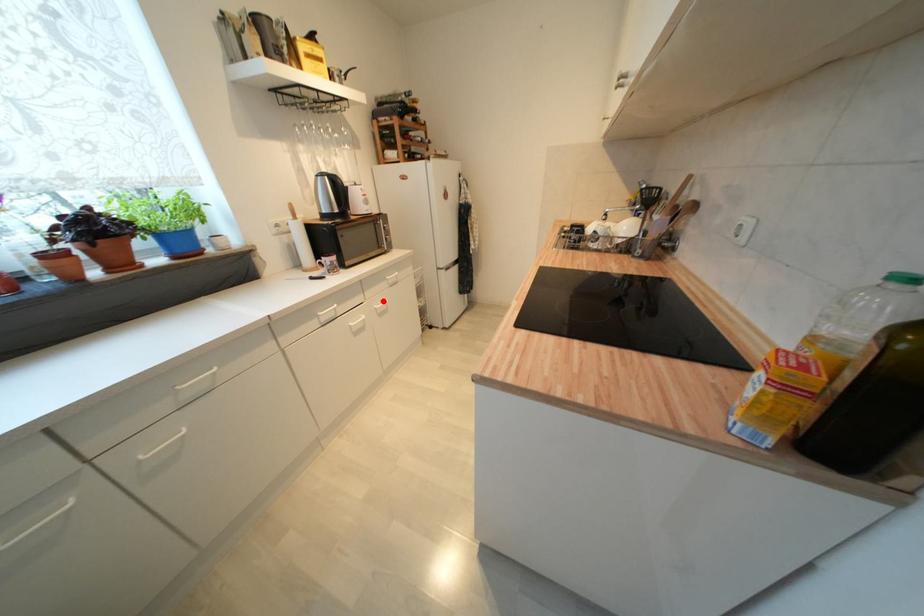
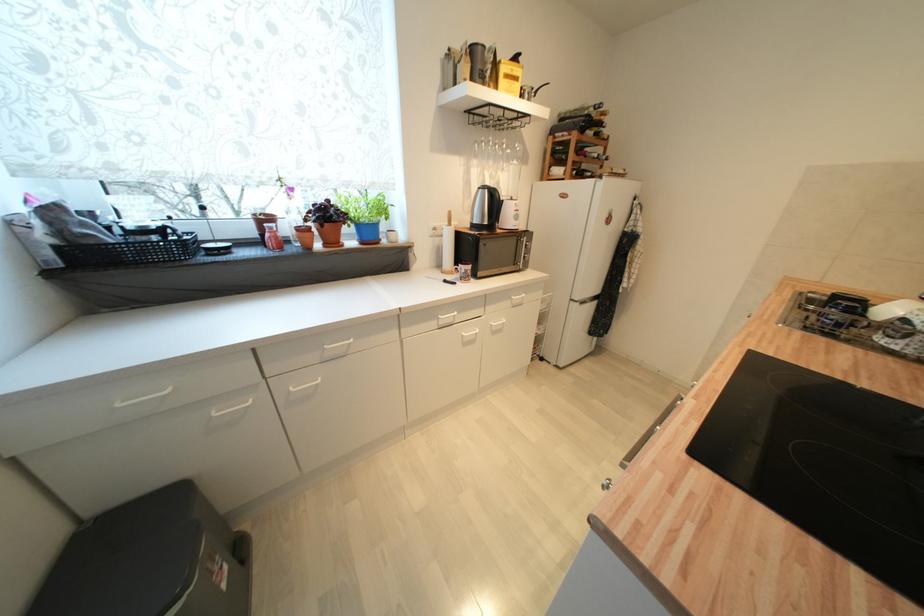
Find the pixel in the second image that matches the highlighted location in the first image.

(502, 318)